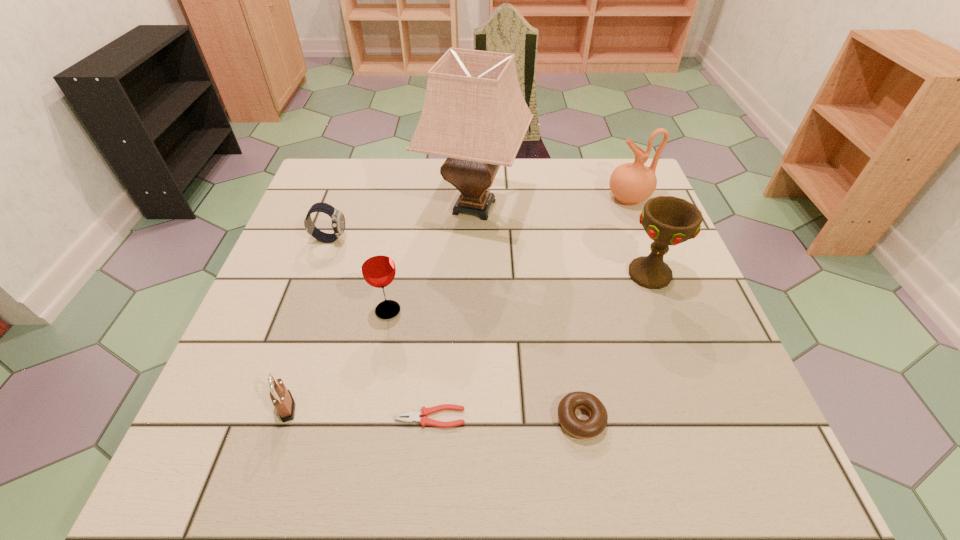
The height and width of the screenshot is (540, 960). Find the location of `vacant space positioned on the spout of the pottery`. vacant space positioned on the spout of the pottery is located at coordinates pos(475,198).

Where is `free space located on the spout of the pottery`? free space located on the spout of the pottery is located at coordinates (526, 198).

This screenshot has width=960, height=540. I want to click on vacant space located on the spout of the pottery, so pyautogui.click(x=504, y=198).

Where is `free space located on the front of the chalice`? The width and height of the screenshot is (960, 540). free space located on the front of the chalice is located at coordinates (663, 312).

You are a GUI agent. You are given a task and a screenshot of the screen. Output one action in this format:
    pyautogui.click(x=<x>, y=<y>)
    Task: Click on the vacant space located on the back of the fourth nearest object
    
    Given the screenshot: What is the action you would take?
    pyautogui.click(x=408, y=204)

Where is `vacant space located on the face of the watch`? This screenshot has height=540, width=960. vacant space located on the face of the watch is located at coordinates (457, 239).

At what (x,y) coordinates should I click in order to perform the action: click on vacant space situated 0.110m on the right of the padlock. Please return your answer as a coordinate pair (x, y). Looking at the image, I should click on (360, 407).

Where is `vacant space located on the front of the doughnut`? vacant space located on the front of the doughnut is located at coordinates (591, 481).

You are a GUI agent. You are given a task and a screenshot of the screen. Output one action in this format:
    pyautogui.click(x=<x>, y=<y>)
    Task: Click on the vacant space located 0.270m on the right of the pliers
    The width and height of the screenshot is (960, 540).
    Given the screenshot: What is the action you would take?
    pyautogui.click(x=621, y=417)

You are a GUI agent. You are given a task and a screenshot of the screen. Output one action in this format:
    pyautogui.click(x=<x>, y=<y>)
    Task: Click on the lampshade positioned at the far edge
    This screenshot has height=540, width=960.
    Given the screenshot: What is the action you would take?
    pyautogui.click(x=474, y=113)